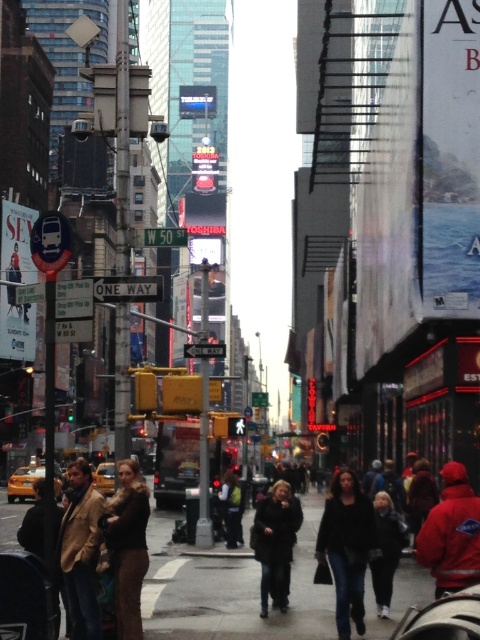
You are a delivery driver navigating through the city streets. You see the white plastic street sign at upper center and the green metallic street sign at center. Which sign is taller?

The green metallic street sign at center is taller than the white plastic street sign at upper center.

Based on the photo, you are a pedestrian standing on the sidewalk in the scene. You see a brown fuzzy coat at lower left and a dark brown leather jacket at lower right. Which of these two items is closer to you?

The brown fuzzy coat at lower left is closer to you because it is positioned over the dark brown leather jacket at lower right.

You are a tailor who needs to determine which coat requires more fabric for a custom order. Based on the image, which coat between the brown fuzzy coat at lower left and the dark brown leather jacket at lower right would need more fabric?

The dark brown leather jacket at lower right requires more fabric because it has a greater width than the brown fuzzy coat at lower left.